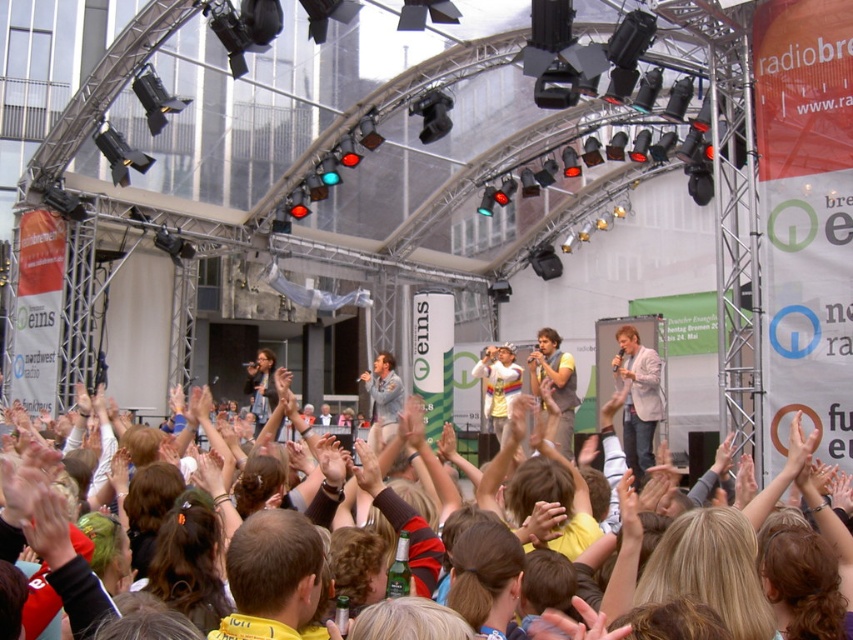
You are a stagehand responsible for adjusting the spotlight positions. You need to ensure that the spotlight can reach both the multicolored fabric crowd at center and the yellow fabric vest at center. Given that the spotlight has a maximum range of 16 meters, will it be able to illuminate both areas?

The distance between the multicolored fabric crowd at center and the yellow fabric vest at center is 15.80 meters. Since the spotlight has a maximum range of 16 meters, it can illuminate both areas as the distance between them is within the spotlight range.

You are a photographer standing at the camera position. You want to take a photo of the light brown blazer at center. Will you be able to capture the entire blazer in your photo without moving the camera?

The light brown blazer at center and camera are 61.51 meters apart from each other. At this distance, it would be challenging to capture the entire blazer in a single photo without moving the camera, as the blazer would appear very small in the frame.

You are a photographer at the concert and want to take a photo of the light brown blazer at center without the multicolored fabric crowd at center blocking it. What should you do?

The multicolored fabric crowd at center is in front of the light brown blazer at center, so you should move to a position where the light brown blazer at center is not obscured by the crowd.